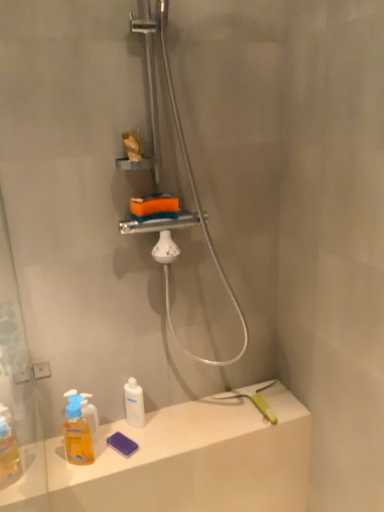
Measure the distance between white glossy bottle at lower center, which is counted as the second mouthwash, starting from the left, and camera.

white glossy bottle at lower center, which is counted as the second mouthwash, starting from the left, is 1.41 meters away from camera.

This screenshot has width=384, height=512. I want to click on white glossy bottle at lower center, which is counted as the second mouthwash, starting from the front, so click(x=134, y=403).

At what (x,y) coordinates should I click in order to perform the action: click on translucent plastic mouthwash at lower left, positioned as the 1th mouthwash in left-to-right order. Please return your answer as a coordinate pair (x, y). Looking at the image, I should click on (77, 433).

Measure the distance between metallic silver shower at upper center and camera.

metallic silver shower at upper center is 3.70 feet from camera.

Measure the distance between point (198,476) and camera.

The depth of point (198,476) is 4.59 feet.

Image resolution: width=384 pixels, height=512 pixels. In order to click on white glossy bottle at lower center, the first mouthwash from the right in this screenshot , I will do `click(134, 403)`.

Looking at the image, does metallic silver shower at upper center seem bigger or smaller compared to translucent plastic mouthwash at lower left, which appears as the first mouthwash when viewed from the front?

In the image, metallic silver shower at upper center appears to be larger than translucent plastic mouthwash at lower left, which appears as the first mouthwash when viewed from the front.

From the picture: Which object is closer to the camera, metallic silver shower at upper center or translucent plastic mouthwash at lower left, which is the second mouthwash from right to left?

metallic silver shower at upper center.

Which is closer to the camera, (153,230) or (81,450)?

The point (153,230) is more forward.

Does matte white counter top at lower left have a smaller size compared to metallic silver shower at upper center?

Yes.

Considering the positions of objects matte white counter top at lower left and metallic silver shower at upper center in the image provided, who is more to the left, matte white counter top at lower left or metallic silver shower at upper center?

Positioned to the left is matte white counter top at lower left.

How different are the orientations of matte white counter top at lower left and metallic silver shower at upper center in degrees?

They differ by 1.18 degrees in their facing directions.

How distant is translucent plastic mouthwash at lower left, which appears as the first mouthwash when viewed from the front, from metallic silver shower at upper center?

23.00 inches.

From the image's perspective, which is below, translucent plastic mouthwash at lower left, positioned as the 1th mouthwash in left-to-right order, or metallic silver shower at upper center?

translucent plastic mouthwash at lower left, positioned as the 1th mouthwash in left-to-right order.

Is there a large distance between translucent plastic mouthwash at lower left, which appears as the first mouthwash when viewed from the front, and metallic silver shower at upper center?

No, translucent plastic mouthwash at lower left, which appears as the first mouthwash when viewed from the front, is in close proximity to metallic silver shower at upper center.

Find the location of a particular element. The width and height of the screenshot is (384, 512). shower that is above the translucent plastic mouthwash at lower left, arranged as the 2th mouthwash when viewed from the back (from a real-world perspective) is located at coordinates (186, 170).

Could you measure the distance between translucent plastic mouthwash at lower left, positioned as the 1th mouthwash in left-to-right order, and matte white counter top at lower left?

translucent plastic mouthwash at lower left, positioned as the 1th mouthwash in left-to-right order, and matte white counter top at lower left are 12.90 inches apart from each other.

Considering the sizes of objects translucent plastic mouthwash at lower left, which is the second mouthwash from right to left, and matte white counter top at lower left in the image provided, who is smaller, translucent plastic mouthwash at lower left, which is the second mouthwash from right to left, or matte white counter top at lower left?

translucent plastic mouthwash at lower left, which is the second mouthwash from right to left, is smaller.

Is translucent plastic mouthwash at lower left, positioned as the 1th mouthwash in left-to-right order, thinner than matte white counter top at lower left?

Indeed, translucent plastic mouthwash at lower left, positioned as the 1th mouthwash in left-to-right order, has a lesser width compared to matte white counter top at lower left.

Which object is more forward, translucent plastic mouthwash at lower left, which appears as the first mouthwash when viewed from the front, or matte white counter top at lower left?

Positioned in front is matte white counter top at lower left.

Between matte white counter top at lower left and white glossy bottle at lower center, the first mouthwash from the right, which one has smaller width?

With smaller width is white glossy bottle at lower center, the first mouthwash from the right.

From their relative heights in the image, would you say matte white counter top at lower left is taller or shorter than white glossy bottle at lower center, which is counted as the second mouthwash, starting from the front?

Clearly, matte white counter top at lower left is shorter compared to white glossy bottle at lower center, which is counted as the second mouthwash, starting from the front.

From a real-world perspective, is matte white counter top at lower left below white glossy bottle at lower center, the first mouthwash from the right?

Indeed, from a real-world perspective, matte white counter top at lower left is positioned beneath white glossy bottle at lower center, the first mouthwash from the right.

Which object is further away from the camera taking this photo, matte white counter top at lower left or white glossy bottle at lower center, which is counted as the second mouthwash, starting from the front?

Positioned behind is white glossy bottle at lower center, which is counted as the second mouthwash, starting from the front.

Is white glossy bottle at lower center, the first mouthwash from the right, at the left side of translucent plastic mouthwash at lower left, arranged as the 2th mouthwash when viewed from the back?

No.

Based on the photo, from the image's perspective, is white glossy bottle at lower center, positioned as the first mouthwash in back-to-front order, under translucent plastic mouthwash at lower left, arranged as the 2th mouthwash when viewed from the back?

No.

Considering the positions of point (140, 405) and point (75, 394), is point (140, 405) closer or farther from the camera than point (75, 394)?

Point (140, 405) appears to be farther away from the viewer than point (75, 394).

From a real-world perspective, which is physically above, white glossy bottle at lower center, which is counted as the second mouthwash, starting from the left, or metallic silver shower at upper center?

metallic silver shower at upper center.

Is white glossy bottle at lower center, which is counted as the second mouthwash, starting from the front, aimed at metallic silver shower at upper center?

No, white glossy bottle at lower center, which is counted as the second mouthwash, starting from the front, is not aimed at metallic silver shower at upper center.

At what (x,y) coordinates should I click in order to perform the action: click on the 1st mouthwash below the metallic silver shower at upper center (from the image's perspective). Please return your answer as a coordinate pair (x, y). The image size is (384, 512). Looking at the image, I should click on (134, 403).

The height and width of the screenshot is (512, 384). I want to click on the 2nd mouthwash to the left when counting from the metallic silver shower at upper center, so click(x=77, y=433).

The width and height of the screenshot is (384, 512). I want to click on counter top below the metallic silver shower at upper center (from the image's perspective), so click(x=182, y=461).

Estimate the real-world distances between objects in this image. Which object is further from translucent plastic mouthwash at lower left, which appears as the first mouthwash when viewed from the front, white glossy bottle at lower center, positioned as the first mouthwash in back-to-front order, or metallic silver shower at upper center?

Based on the image, metallic silver shower at upper center appears to be further to translucent plastic mouthwash at lower left, which appears as the first mouthwash when viewed from the front.

From the image, which object appears to be farther from metallic silver shower at upper center, translucent plastic mouthwash at lower left, arranged as the 2th mouthwash when viewed from the back, or matte white counter top at lower left?

translucent plastic mouthwash at lower left, arranged as the 2th mouthwash when viewed from the back, is further to metallic silver shower at upper center.

Estimate the real-world distances between objects in this image. Which object is closer to white glossy bottle at lower center, which is counted as the second mouthwash, starting from the front, matte white counter top at lower left or translucent plastic mouthwash at lower left, which appears as the first mouthwash when viewed from the front?

Among the two, translucent plastic mouthwash at lower left, which appears as the first mouthwash when viewed from the front, is located nearer to white glossy bottle at lower center, which is counted as the second mouthwash, starting from the front.

Considering their positions, is white glossy bottle at lower center, the first mouthwash from the right, positioned closer to translucent plastic mouthwash at lower left, which appears as the first mouthwash when viewed from the front, than matte white counter top at lower left?

white glossy bottle at lower center, the first mouthwash from the right, is closer to translucent plastic mouthwash at lower left, which appears as the first mouthwash when viewed from the front.

Estimate the real-world distances between objects in this image. Which object is further from white glossy bottle at lower center, which is counted as the second mouthwash, starting from the left, matte white counter top at lower left or metallic silver shower at upper center?

metallic silver shower at upper center is further to white glossy bottle at lower center, which is counted as the second mouthwash, starting from the left.

Which object lies nearer to the anchor point white glossy bottle at lower center, positioned as the first mouthwash in back-to-front order, metallic silver shower at upper center or matte white counter top at lower left?

matte white counter top at lower left.

From the image, which object appears to be farther from metallic silver shower at upper center, matte white counter top at lower left or translucent plastic mouthwash at lower left, which is the second mouthwash from right to left?

Based on the image, translucent plastic mouthwash at lower left, which is the second mouthwash from right to left, appears to be further to metallic silver shower at upper center.

When comparing their distances from translucent plastic mouthwash at lower left, which is the second mouthwash from right to left, does metallic silver shower at upper center or matte white counter top at lower left seem further?

metallic silver shower at upper center is positioned further to the anchor translucent plastic mouthwash at lower left, which is the second mouthwash from right to left.

The image size is (384, 512). Identify the location of mouthwash between translucent plastic mouthwash at lower left, which is the second mouthwash from right to left, and matte white counter top at lower left from left to right. (134, 403).

Image resolution: width=384 pixels, height=512 pixels. Identify the location of mouthwash between metallic silver shower at upper center and translucent plastic mouthwash at lower left, which is the second mouthwash from right to left, in the up-down direction. (134, 403).